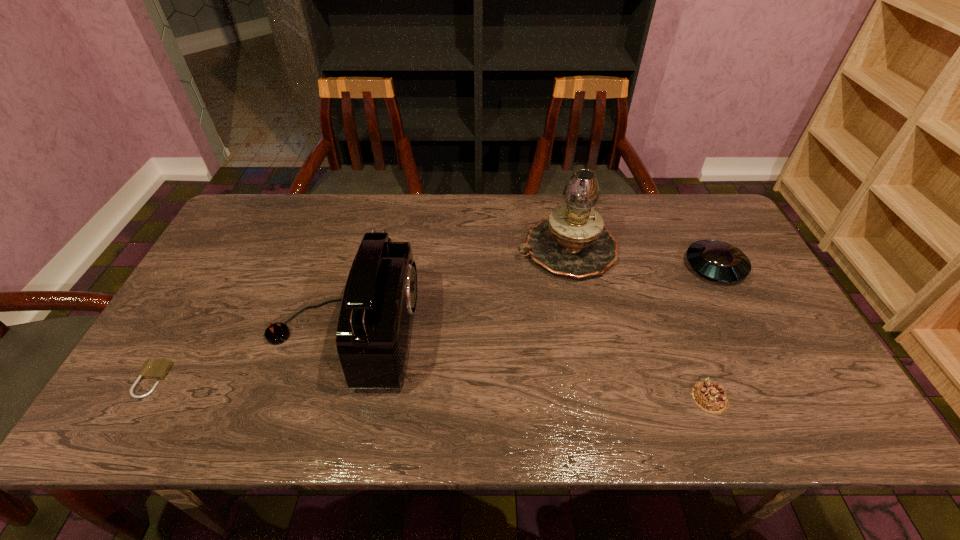
Locate an element on the screen. The width and height of the screenshot is (960, 540). oil lamp is located at coordinates (572, 241).

What are the coordinates of `the fourth object from right to left` in the screenshot? It's located at (x=374, y=330).

Where is `the third tallest object`? The height and width of the screenshot is (540, 960). the third tallest object is located at coordinates [717, 260].

This screenshot has width=960, height=540. What are the coordinates of `the rightmost object` in the screenshot? It's located at (717, 260).

The height and width of the screenshot is (540, 960). I want to click on chocolate cake, so click(710, 397).

Find the location of `the second shortest object`. the second shortest object is located at coordinates (710, 397).

Image resolution: width=960 pixels, height=540 pixels. I want to click on the shortest object, so click(153, 368).

Where is `the leftmost object`? The width and height of the screenshot is (960, 540). the leftmost object is located at coordinates (153, 368).

Identify the location of blank area located 0.130m on the right of the third object from left to right. The height and width of the screenshot is (540, 960). (660, 249).

What are the coordinates of `free location located 0.160m on the front-facing side of the fourth object from right to left` in the screenshot? It's located at (479, 333).